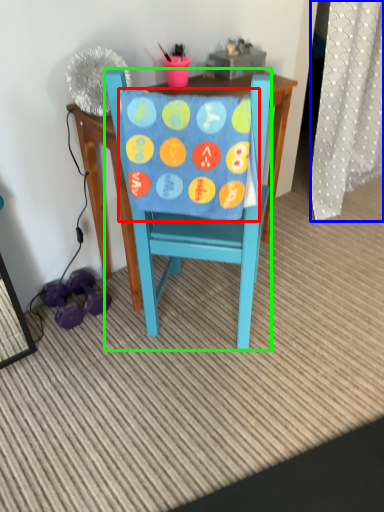
Question: Considering the real-world distances, which object is closest to blanket (highlighted by a red box)? curtain (highlighted by a blue box) or chair (highlighted by a green box).

Choices:
 (A) curtain
 (B) chair

Answer: (B)